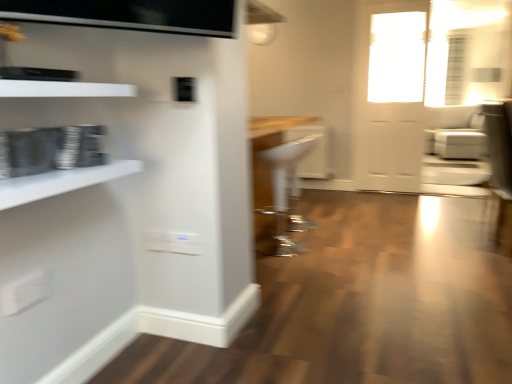
Identify the location of white leather armchair at right, positioned as the second armchair in front-to-back order. (458, 140).

Find the location of a particular element. This screenshot has width=512, height=384. white glossy door at upper right is located at coordinates (390, 94).

What is the approximate height of clear glass door at upper right?

1.39 meters.

What do you see at coordinates (456, 67) in the screenshot?
I see `clear glass door at upper right` at bounding box center [456, 67].

The height and width of the screenshot is (384, 512). What do you see at coordinates (287, 192) in the screenshot?
I see `white plastic stool at center, the 1th armchair in the front-to-back sequence` at bounding box center [287, 192].

This screenshot has width=512, height=384. In order to click on white glossy shelf at upper left, arranged as the 2th shelf when ordered from the bottom in this screenshot , I will do `click(64, 89)`.

Considering the relative positions of white plastic stool at center, marked as the second armchair in a back-to-front arrangement, and white glossy shelf at left, placed as the 2th shelf when sorted from top to bottom, in the image provided, is white plastic stool at center, marked as the second armchair in a back-to-front arrangement, to the right of white glossy shelf at left, placed as the 2th shelf when sorted from top to bottom, from the viewer's perspective?

Correct, you'll find white plastic stool at center, marked as the second armchair in a back-to-front arrangement, to the right of white glossy shelf at left, placed as the 2th shelf when sorted from top to bottom.

Measure the distance between white plastic stool at center, marked as the first armchair in a bottom-to-top arrangement, and white glossy shelf at left, which is the 1th shelf in bottom-to-top order.

white plastic stool at center, marked as the first armchair in a bottom-to-top arrangement, and white glossy shelf at left, which is the 1th shelf in bottom-to-top order, are 1.87 meters apart from each other.

Is white glossy shelf at left, which is the 1th shelf in bottom-to-top order, at the back of white plastic stool at center, the 1th armchair in the front-to-back sequence?

No, white plastic stool at center, the 1th armchair in the front-to-back sequence, is not facing away from white glossy shelf at left, which is the 1th shelf in bottom-to-top order.

Looking at their sizes, would you say white plastic stool at center, the 2th armchair viewed from the right, is wider or thinner than white glossy shelf at left, placed as the 2th shelf when sorted from top to bottom?

Considering their sizes, white plastic stool at center, the 2th armchair viewed from the right, looks broader than white glossy shelf at left, placed as the 2th shelf when sorted from top to bottom.

From a real-world perspective, is white glossy shelf at upper left, the 1th shelf from the top, below white glossy shelf at left, which is the 1th shelf in bottom-to-top order?

No, from a real-world perspective, white glossy shelf at upper left, the 1th shelf from the top, is not beneath white glossy shelf at left, which is the 1th shelf in bottom-to-top order.

Measure the distance from white glossy shelf at upper left, the 1th shelf from the top, to white glossy shelf at left, which is the 1th shelf in bottom-to-top order.

A distance of 9.48 inches exists between white glossy shelf at upper left, the 1th shelf from the top, and white glossy shelf at left, which is the 1th shelf in bottom-to-top order.

Which object is closer to the camera, white glossy shelf at upper left, the 1th shelf from the top, or white glossy shelf at left, which is the 1th shelf in bottom-to-top order?

white glossy shelf at upper left, the 1th shelf from the top, is in front.

Is white glossy shelf at upper left, arranged as the 2th shelf when ordered from the bottom, looking in the opposite direction of white glossy shelf at left, which is the 1th shelf in bottom-to-top order?

No, white glossy shelf at upper left, arranged as the 2th shelf when ordered from the bottom, is not facing the opposite direction of white glossy shelf at left, which is the 1th shelf in bottom-to-top order.

Is white glossy shelf at upper left, the 1th shelf from the top, surrounding white glossy door at upper right?

That's incorrect, white glossy door at upper right is not inside white glossy shelf at upper left, the 1th shelf from the top.

Is white glossy door at upper right at the back of white glossy shelf at upper left, arranged as the 2th shelf when ordered from the bottom?

white glossy shelf at upper left, arranged as the 2th shelf when ordered from the bottom, is not turned away from white glossy door at upper right.

Looking at their sizes, would you say white glossy shelf at upper left, the 1th shelf from the top, is wider or thinner than white glossy door at upper right?

Considering their sizes, white glossy shelf at upper left, the 1th shelf from the top, looks broader than white glossy door at upper right.

From the image's perspective, is white glossy shelf at upper left, the 1th shelf from the top, above or below white glossy door at upper right?

Clearly, from the image's perspective, white glossy shelf at upper left, the 1th shelf from the top, is below white glossy door at upper right.

Is white glossy door at upper right positioned beyond the bounds of white leather armchair at right, which is counted as the 1th armchair, starting from the top?

Yes, white glossy door at upper right is located beyond the bounds of white leather armchair at right, which is counted as the 1th armchair, starting from the top.

Is white glossy door at upper right not close to white leather armchair at right, the 1th armchair from the right?

No, white glossy door at upper right is in close proximity to white leather armchair at right, the 1th armchair from the right.

Can you confirm if white glossy door at upper right is positioned to the left of white leather armchair at right, positioned as the 2th armchair in left-to-right order?

Yes.

From the image's perspective, which object appears higher, white glossy shelf at left, placed as the 2th shelf when sorted from top to bottom, or white leather armchair at right, the 1th armchair from the right?

white leather armchair at right, the 1th armchair from the right.

Is white glossy shelf at left, placed as the 2th shelf when sorted from top to bottom, facing away from white leather armchair at right, positioned as the first armchair in back-to-front order?

white glossy shelf at left, placed as the 2th shelf when sorted from top to bottom, is not turned away from white leather armchair at right, positioned as the first armchair in back-to-front order.

Can you tell me how much white glossy shelf at left, placed as the 2th shelf when sorted from top to bottom, and white leather armchair at right, positioned as the first armchair in back-to-front order, differ in facing direction?

91.2 degrees.

Are white glossy shelf at left, placed as the 2th shelf when sorted from top to bottom, and white leather armchair at right, positioned as the second armchair in front-to-back order, far apart?

Absolutely, white glossy shelf at left, placed as the 2th shelf when sorted from top to bottom, is distant from white leather armchair at right, positioned as the second armchair in front-to-back order.

Between white plastic stool at center, the 1th armchair in the front-to-back sequence, and white leather armchair at right, which is the 2th armchair from bottom to top, which one has larger width?

Wider between the two is white leather armchair at right, which is the 2th armchair from bottom to top.

Is point (285, 175) closer or farther from the camera than point (474, 159)?

Point (285, 175).

From the image's perspective, who appears lower, white plastic stool at center, the 2th armchair viewed from the right, or white leather armchair at right, positioned as the 2th armchair in left-to-right order?

From the image's view, white plastic stool at center, the 2th armchair viewed from the right, is below.

You are a GUI agent. You are given a task and a screenshot of the screen. Output one action in this format:
    pyautogui.click(x=<x>, y=<y>)
    Task: Click on the armchair on the right of white plastic stool at center, the 1th armchair in the front-to-back sequence
    This screenshot has height=384, width=512.
    Given the screenshot: What is the action you would take?
    pyautogui.click(x=458, y=140)

Is white plastic stool at center, the 1th armchair viewed from the left, located outside clear glass door at upper right?

Yes, white plastic stool at center, the 1th armchair viewed from the left, is not within clear glass door at upper right.

Is white plastic stool at center, marked as the first armchair in a bottom-to-top arrangement, directly adjacent to clear glass door at upper right?

No, white plastic stool at center, marked as the first armchair in a bottom-to-top arrangement, is not with clear glass door at upper right.

From a real-world perspective, is white plastic stool at center, positioned as the 2th armchair in top-to-bottom order, under clear glass door at upper right?

Correct, in the physical world, white plastic stool at center, positioned as the 2th armchair in top-to-bottom order, is lower than clear glass door at upper right.

Which point is more forward, (x=276, y=230) or (x=463, y=84)?

The point (x=276, y=230) is more forward.

I want to click on the 1st shelf above the white plastic stool at center, marked as the second armchair in a back-to-front arrangement (from the image's perspective), so click(61, 182).

This screenshot has width=512, height=384. What are the coordinates of `shelf lying in front of the white glossy shelf at left, placed as the 2th shelf when sorted from top to bottom` in the screenshot? It's located at (64, 89).

Based on their spatial positions, is white glossy shelf at upper left, arranged as the 2th shelf when ordered from the bottom, or white glossy door at upper right closer to clear glass door at upper right?

white glossy door at upper right is closer to clear glass door at upper right.

Based on their spatial positions, is white plastic stool at center, positioned as the 2th armchair in top-to-bottom order, or clear glass door at upper right closer to white leather armchair at right, positioned as the first armchair in back-to-front order?

clear glass door at upper right.

Considering their positions, is white leather armchair at right, positioned as the first armchair in back-to-front order, positioned further to white glossy shelf at upper left, arranged as the 2th shelf when ordered from the bottom, than white plastic stool at center, positioned as the 2th armchair in top-to-bottom order?

white leather armchair at right, positioned as the first armchair in back-to-front order, is positioned further to the anchor white glossy shelf at upper left, arranged as the 2th shelf when ordered from the bottom.

Considering their positions, is white glossy door at upper right positioned further to clear glass door at upper right than white glossy shelf at upper left, arranged as the 2th shelf when ordered from the bottom?

white glossy shelf at upper left, arranged as the 2th shelf when ordered from the bottom, lies further to clear glass door at upper right than the other object.

When comparing their distances from white glossy shelf at left, which is the 1th shelf in bottom-to-top order, does white plastic stool at center, marked as the first armchair in a bottom-to-top arrangement, or clear glass door at upper right seem further?

clear glass door at upper right is positioned further to the anchor white glossy shelf at left, which is the 1th shelf in bottom-to-top order.

Estimate the real-world distances between objects in this image. Which object is closer to white glossy shelf at left, which is the 1th shelf in bottom-to-top order, white plastic stool at center, positioned as the 2th armchair in top-to-bottom order, or white glossy door at upper right?

white plastic stool at center, positioned as the 2th armchair in top-to-bottom order.

Considering their positions, is white glossy door at upper right positioned closer to white glossy shelf at upper left, the 1th shelf from the top, than clear glass door at upper right?

white glossy door at upper right is closer to white glossy shelf at upper left, the 1th shelf from the top.

In the scene shown: When comparing their distances from white glossy shelf at upper left, arranged as the 2th shelf when ordered from the bottom, does white glossy door at upper right or white glossy shelf at left, which is the 1th shelf in bottom-to-top order, seem closer?

Among the two, white glossy shelf at left, which is the 1th shelf in bottom-to-top order, is located nearer to white glossy shelf at upper left, arranged as the 2th shelf when ordered from the bottom.

The image size is (512, 384). Find the location of `shelf positioned between white glossy shelf at upper left, arranged as the 2th shelf when ordered from the bottom, and clear glass door at upper right from near to far`. shelf positioned between white glossy shelf at upper left, arranged as the 2th shelf when ordered from the bottom, and clear glass door at upper right from near to far is located at coordinates pos(61,182).

Find the location of a particular element. armchair between white glossy shelf at left, placed as the 2th shelf when sorted from top to bottom, and white glossy door at upper right in the front-back direction is located at coordinates (287, 192).

In order to click on armchair between white glossy shelf at left, which is the 1th shelf in bottom-to-top order, and white leather armchair at right, which is the 2th armchair from bottom to top, from front to back in this screenshot , I will do `click(287, 192)`.

Image resolution: width=512 pixels, height=384 pixels. What are the coordinates of `door between white glossy shelf at left, placed as the 2th shelf when sorted from top to bottom, and white leather armchair at right, positioned as the first armchair in back-to-front order, along the z-axis` in the screenshot? It's located at (390, 94).